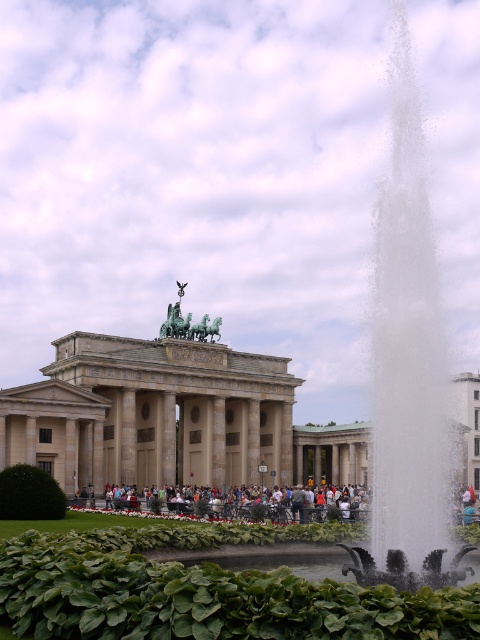
Question: Is white frothy water at right bigger than green polished stone sculpture at center?

Choices:
 (A) yes
 (B) no

Answer: (A)

Question: Is stone classical building at center positioned at the back of green polished stone sculpture at center?

Choices:
 (A) yes
 (B) no

Answer: (B)

Question: Which object appears farthest from the camera in this image?

Choices:
 (A) light gray concrete people at center
 (B) stone classical building at center
 (C) white frothy water at right

Answer: (A)

Question: Estimate the real-world distances between objects in this image. Which object is farther from the white frothy water at right?

Choices:
 (A) green polished stone sculpture at center
 (B) stone classical building at center

Answer: (A)

Question: Is light gray concrete people at center to the right of green polished stone sculpture at center from the viewer's perspective?

Choices:
 (A) no
 (B) yes

Answer: (B)

Question: Which point is closer to the camera?

Choices:
 (A) stone classical building at center
 (B) white frothy water at right
 (C) green polished stone sculpture at center

Answer: (B)